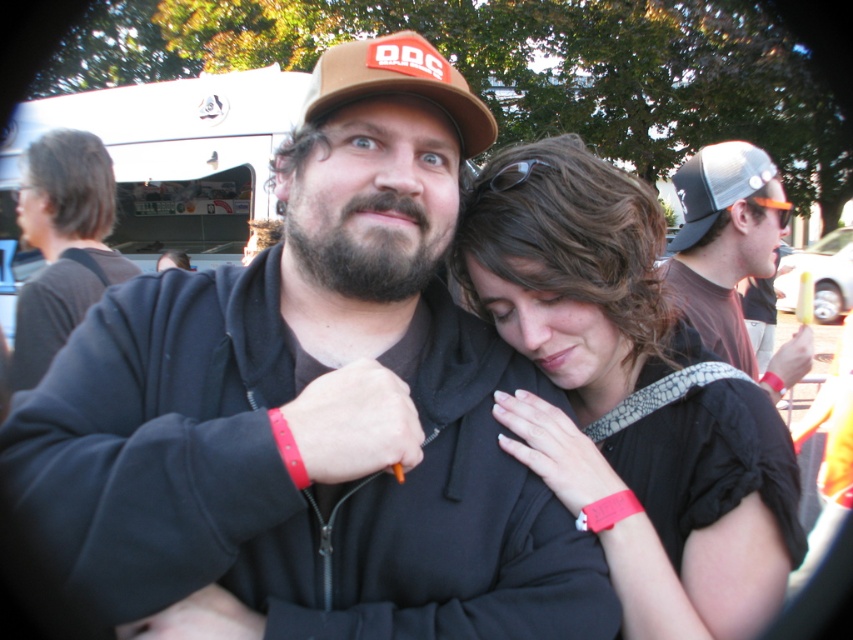
Question: Among these objects, which one is farthest from the camera?

Choices:
 (A) brown fabric baseball cap at upper center
 (B) black matte jacket at center

Answer: (A)

Question: Which point is farther to the camera?

Choices:
 (A) dark brown thick beard at center
 (B) black matte jacket at center

Answer: (A)

Question: Is brown fabric baseball cap at upper center below black mesh baseball cap at upper right?

Choices:
 (A) no
 (B) yes

Answer: (B)

Question: Does matte black hoodie at left appear on the left side of dark brown thick beard at center?

Choices:
 (A) no
 (B) yes

Answer: (B)

Question: Which point is closer to the camera taking this photo?

Choices:
 (A) (114, 198)
 (B) (503, 260)
 (C) (386, 44)

Answer: (C)

Question: Is brown fabric baseball cap at upper center to the left of black mesh baseball cap at upper right from the viewer's perspective?

Choices:
 (A) no
 (B) yes

Answer: (B)